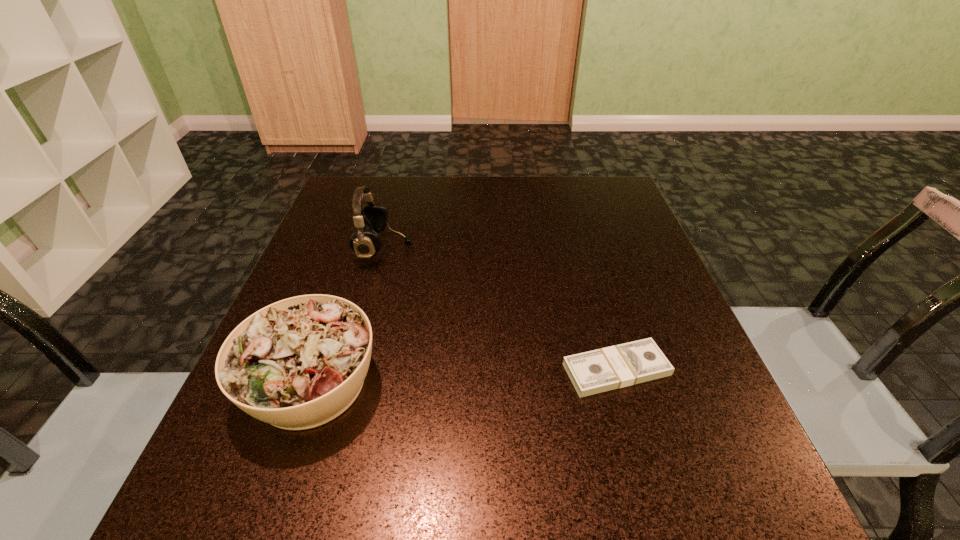
This screenshot has height=540, width=960. I want to click on the farthest object, so click(373, 218).

Locate an element on the screen. the tallest object is located at coordinates click(x=373, y=218).

The image size is (960, 540). I want to click on salad, so click(298, 363).

The image size is (960, 540). I want to click on dollar, so click(x=618, y=366).

Image resolution: width=960 pixels, height=540 pixels. What are the coordinates of `the shortest object` in the screenshot? It's located at (618, 366).

You are a GUI agent. You are given a task and a screenshot of the screen. Output one action in this format:
    pyautogui.click(x=<x>, y=<y>)
    Task: Click on the vacant space located 0.050m with the microphone on the side of the tallest object
    The width and height of the screenshot is (960, 540).
    Given the screenshot: What is the action you would take?
    pyautogui.click(x=433, y=247)

Image resolution: width=960 pixels, height=540 pixels. Find the location of `vacant space situated on the right of the second tallest object`. vacant space situated on the right of the second tallest object is located at coordinates (x=514, y=383).

Image resolution: width=960 pixels, height=540 pixels. Find the location of `vacant space located 0.130m on the left of the rightmost object`. vacant space located 0.130m on the left of the rightmost object is located at coordinates (487, 369).

Locate an element on the screen. headset that is positioned at the left edge is located at coordinates (373, 218).

The image size is (960, 540). Identify the location of salad that is at the left edge. (298, 363).